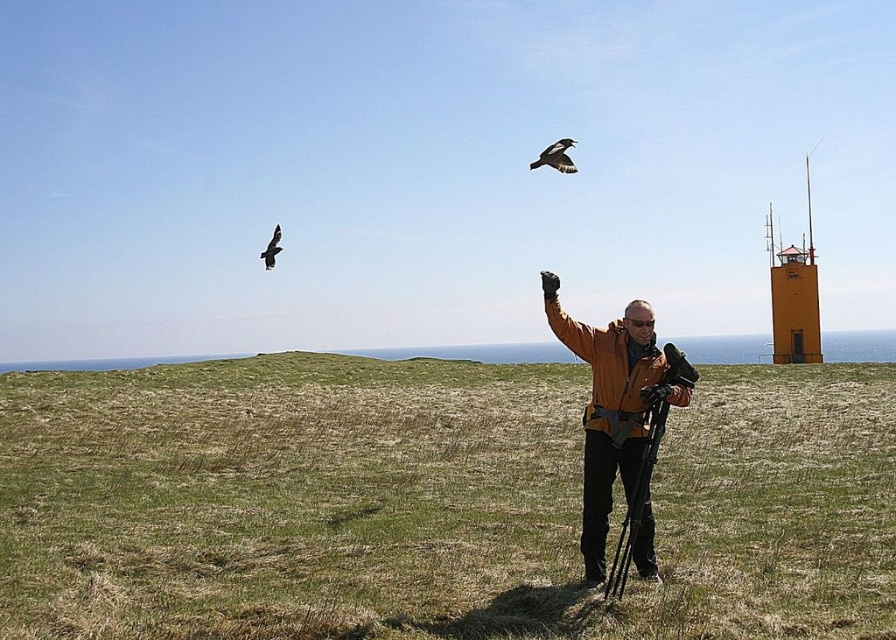
You are a hiker who wants to take a photo of the orange softshell jacket at center. You notice that the jacket is exactly at point (618, 419). If you want to frame the jacket in the center of your camera viewfinder, which coordinate should you aim for?

The orange softshell jacket at center is already positioned at point (618, 419), so you should aim for that exact coordinate to center it in your camera viewfinder.

You are a photographer standing on the grassy hill and want to capture the two birds flying in the sky. You notice two points in the sky where the birds were last seen. The first point is at coordinate point(815, 413) and the second point is at coordinate point(618, 378). Which point is closer to the horizon?

Point(618, 378) is closer to the horizon because it is in front of point(815, 413), which is behind it.

You are a photographer standing at the point with coordinates point (x=599, y=400). You want to move to the point with coordinates point (x=269, y=260) to adjust your camera settings. Given the terrain described in the scene, is the path between these two points likely to be clear of obstacles?

Point (x=599, y=400) is in front of point (x=269, y=260), so the path between them is likely clear of obstacles as there are no objects mentioned between them in the scene description.